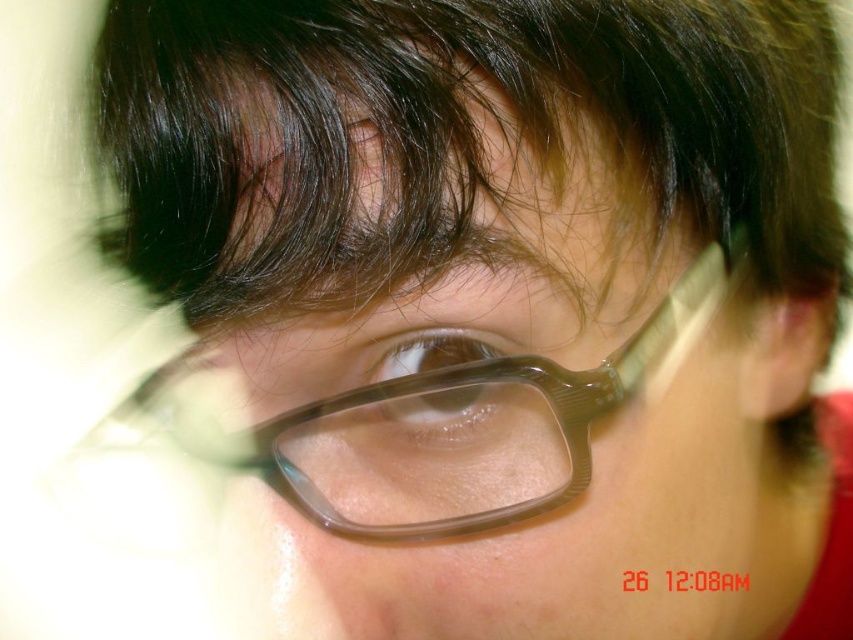
Who is positioned more to the right, transparent plastic glasses at center or translucent plastic eye at center?

Positioned to the right is transparent plastic glasses at center.

Locate an element on the screen. transparent plastic glasses at center is located at coordinates (437, 426).

At what (x,y) coordinates should I click in order to perform the action: click on transparent plastic glasses at center. Please return your answer as a coordinate pair (x, y). The width and height of the screenshot is (853, 640). Looking at the image, I should click on (437, 426).

Who is shorter, translucent plastic bangs at upper center or translucent plastic eye at center?

Standing shorter between the two is translucent plastic eye at center.

Does translucent plastic bangs at upper center appear under translucent plastic eye at center?

Incorrect, translucent plastic bangs at upper center is not positioned below translucent plastic eye at center.

You are a GUI agent. You are given a task and a screenshot of the screen. Output one action in this format:
    pyautogui.click(x=<x>, y=<y>)
    Task: Click on the translucent plastic bangs at upper center
    The width and height of the screenshot is (853, 640).
    Given the screenshot: What is the action you would take?
    [x=447, y=134]

This screenshot has width=853, height=640. I want to click on translucent plastic bangs at upper center, so click(447, 134).

Can you confirm if translucent plastic bangs at upper center is thinner than transparent plastic glasses at center?

No.

Between point (709, 131) and point (445, 422), which one is positioned in front?

Point (445, 422) is in front.

I want to click on translucent plastic bangs at upper center, so click(447, 134).